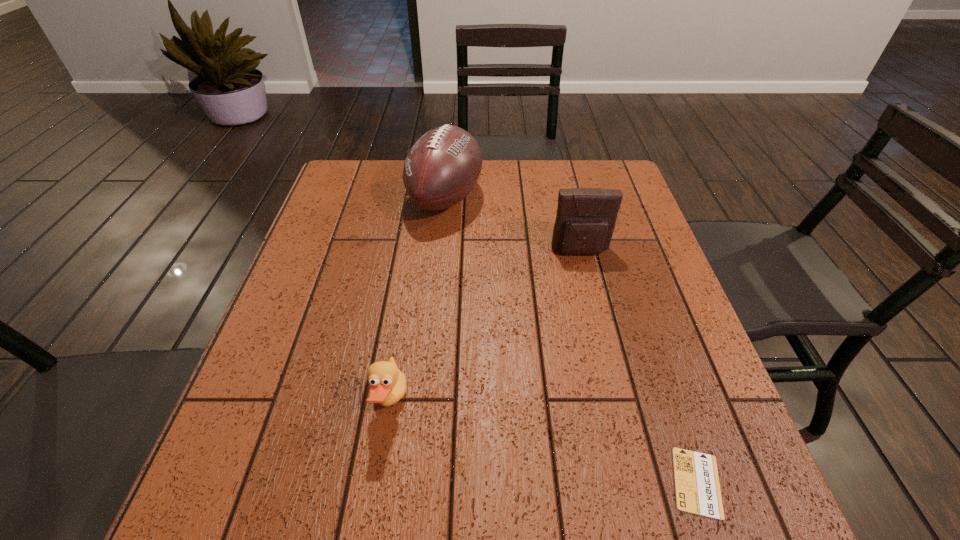
Identify the location of vacant space situated 0.280m on the beak of the duck. This screenshot has height=540, width=960. (555, 402).

This screenshot has height=540, width=960. What are the coordinates of `vacant space located on the back of the nearest object` in the screenshot? It's located at (670, 401).

Locate an element on the screen. object present at the far edge is located at coordinates (443, 166).

Where is `object that is positioned at the near edge`? Image resolution: width=960 pixels, height=540 pixels. object that is positioned at the near edge is located at coordinates (697, 486).

Where is `pouch present at the right edge`? This screenshot has width=960, height=540. pouch present at the right edge is located at coordinates point(586,217).

Where is `identity card situated at the right edge`? This screenshot has width=960, height=540. identity card situated at the right edge is located at coordinates (697, 486).

Where is `object positioned at the near right corner`? Image resolution: width=960 pixels, height=540 pixels. object positioned at the near right corner is located at coordinates (697, 486).

The height and width of the screenshot is (540, 960). I want to click on vacant region at the far edge of the desktop, so click(x=400, y=190).

Identify the location of vacant space at the near edge of the desktop. (438, 521).

Identify the location of vacant space at the left edge. The width and height of the screenshot is (960, 540). (266, 388).